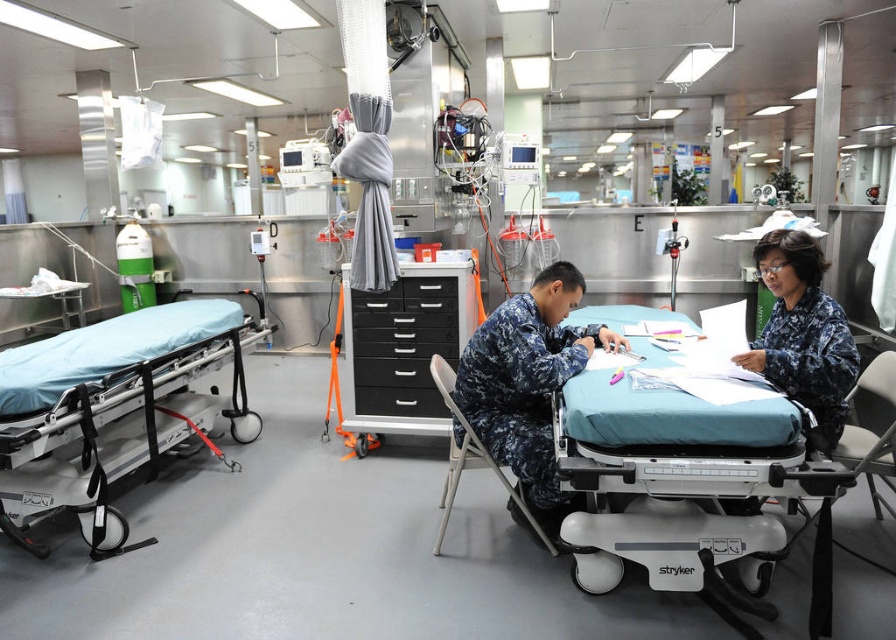
You are a nurse on a ship and need to locate the teal fabric stretcher at center. According to the room layout, where exactly is it positioned?

The teal fabric stretcher at center is located at point (685, 497) in the room.